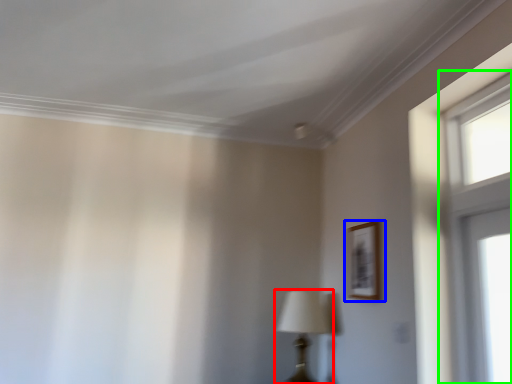
Question: Which object is the farthest from table lamp (highlighted by a red box)? Choose among these: picture frame (highlighted by a blue box) or window (highlighted by a green box).

Choices:
 (A) picture frame
 (B) window

Answer: (B)